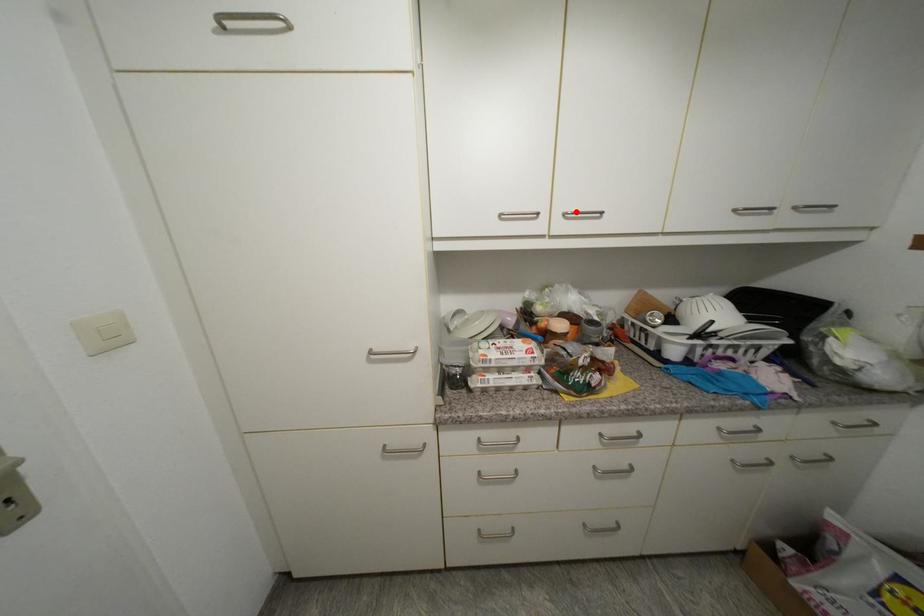
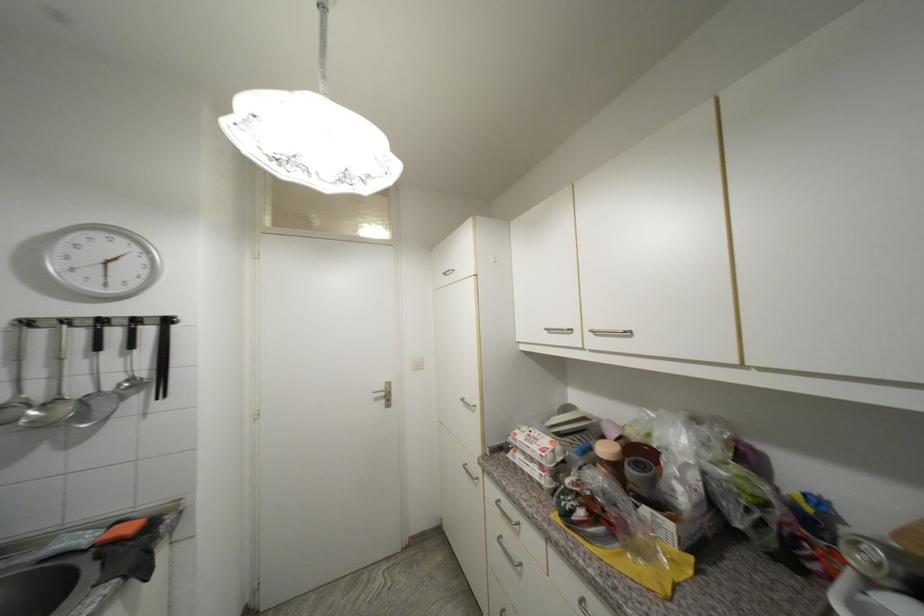
In the second image, find the point that corresponds to the highlighted location in the first image.

(601, 330)